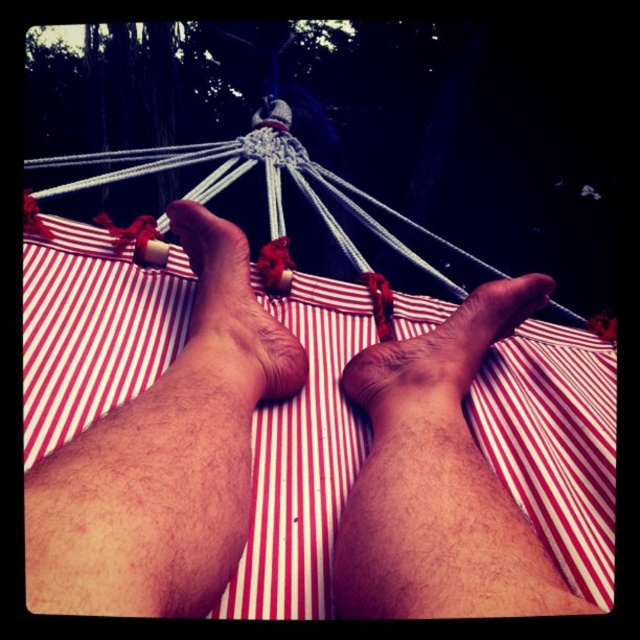
You are a photographer trying to capture the red striped fabric foot at center and the brown skin at center in the image. Which object appears larger in the photo?

The red striped fabric foot at center appears much taller than the brown skin at center in the photo.

Based on the photo, you are standing in front of the hammock and want to place a small pillow on the red striped fabric at center. Based on the coordinates provided, where exactly should you place the pillow?

The red striped fabric at center is located at point (298, 440), so you should place the pillow at those coordinates to ensure it rests on the fabric.